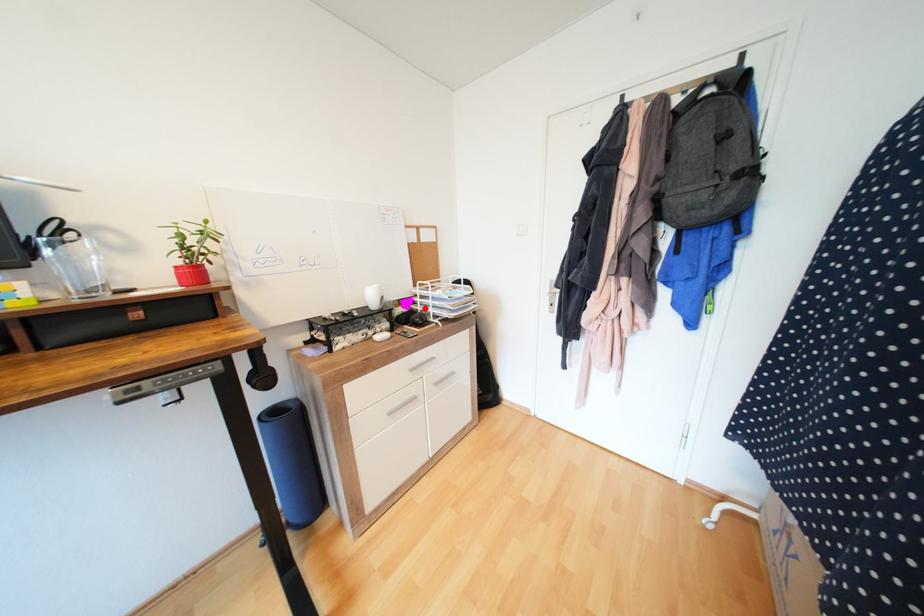
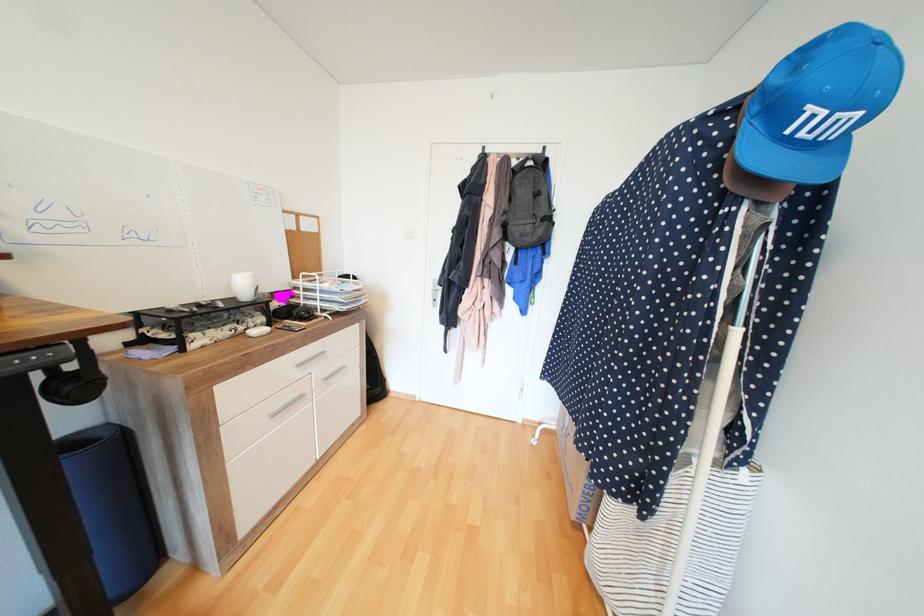
Find the pixel in the second image that matches the highlighted location in the first image.

(308, 302)